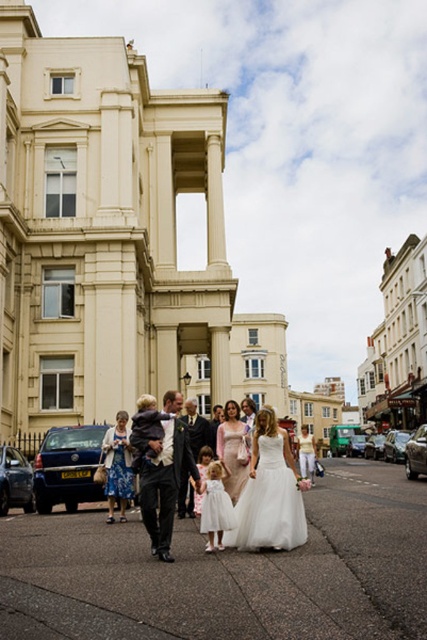
You are a photographer positioned on the street and want to take a photo of the matte white dress at center and the dark suit at center. Which one will appear larger in the photo?

The matte white dress at center will appear larger in the photo because it is closer to the viewer than the dark suit at center.